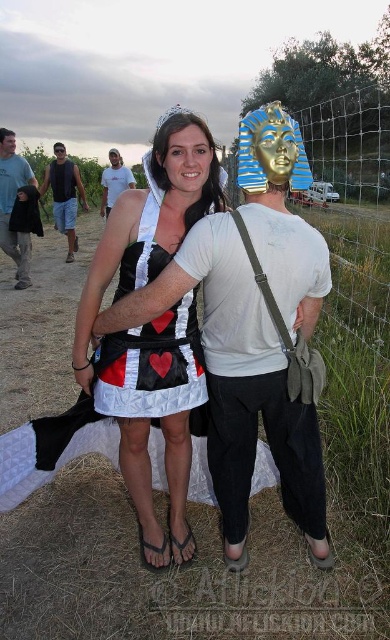
Does quilted fabric dress at center have a larger size compared to brushed metal water at bottle left?

Yes, quilted fabric dress at center is bigger than brushed metal water at bottle left.

Locate an element on the screen. This screenshot has height=640, width=390. quilted fabric dress at center is located at coordinates (253, 330).

This screenshot has height=640, width=390. Find the location of `quilted fabric dress at center`. quilted fabric dress at center is located at coordinates pos(253,330).

Which of these two, brushed metal water at bottle left or matte black tank top at left, stands taller?

With more height is brushed metal water at bottle left.

Is brushed metal water at bottle left to the left of matte black tank top at left from the viewer's perspective?

Indeed, brushed metal water at bottle left is positioned on the left side of matte black tank top at left.

Between point (19, 156) and point (63, 216), which one is positioned in front?

Point (63, 216) is more forward.

Where is `brushed metal water at bottle left`? This screenshot has width=390, height=640. brushed metal water at bottle left is located at coordinates (17, 208).

Which is more to the left, brushed metal water at bottle left or matte white t-shirt at center?

From the viewer's perspective, brushed metal water at bottle left appears more on the left side.

Which is in front, point (24, 161) or point (122, 161)?

Point (24, 161)

Does point (26, 250) come farther from viewer compared to point (102, 188)?

No, (26, 250) is in front of (102, 188).

The image size is (390, 640). Identify the location of brushed metal water at bottle left. (17, 208).